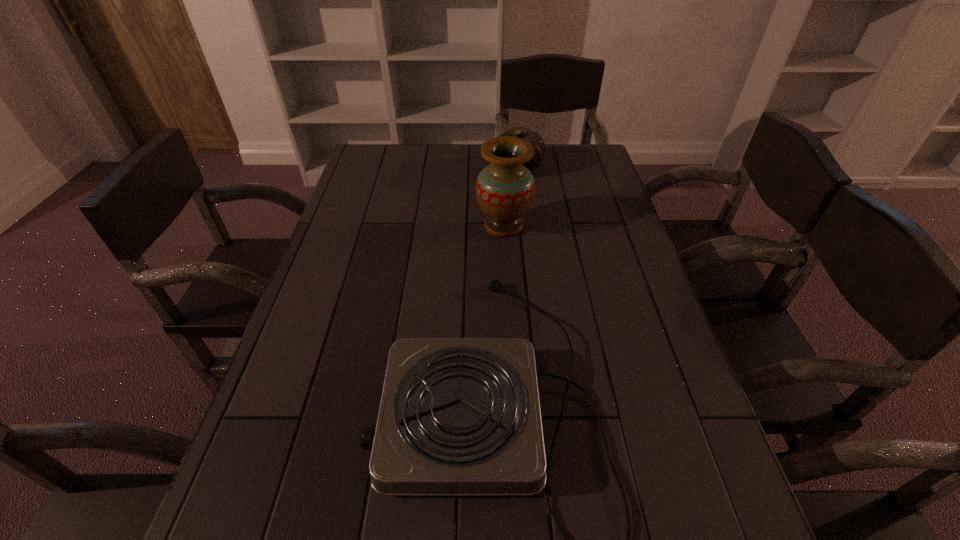
This screenshot has height=540, width=960. In order to click on free space at the far right corner of the desktop in this screenshot , I will do `click(576, 156)`.

Locate which object ranks second in proximity to the gourd. Please provide its 2D coordinates. Your answer should be formatted as a tuple, i.e. [(x, y)], where the tuple contains the x and y coordinates of a point satisfying the conditions above.

[(458, 416)]

Identify which object is the second closest to the vase. Please provide its 2D coordinates. Your answer should be formatted as a tuple, i.e. [(x, y)], where the tuple contains the x and y coordinates of a point satisfying the conditions above.

[(458, 416)]